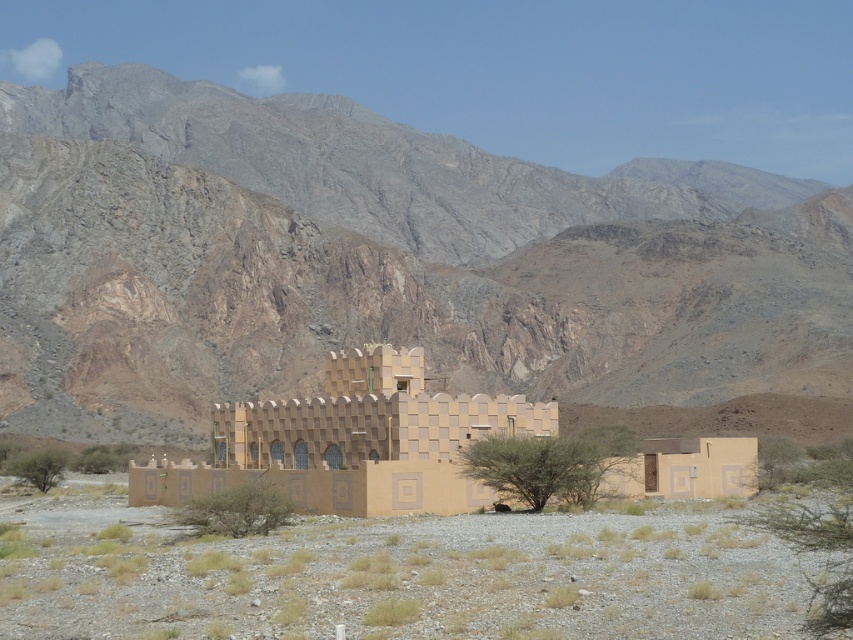
Can you confirm if brown rocky mountain range at upper center is positioned to the left of beige textured fort at center?

Yes, brown rocky mountain range at upper center is to the left of beige textured fort at center.

Who is lower down, brown rocky mountain range at upper center or beige textured fort at center?

Positioned lower is beige textured fort at center.

Which is behind, point (712, 339) or point (321, 488)?

The point (712, 339) is behind.

Where is `brown rocky mountain range at upper center`? brown rocky mountain range at upper center is located at coordinates (380, 260).

Does brown rocky mountain range at upper center appear over beige sand at center?

Indeed, brown rocky mountain range at upper center is positioned over beige sand at center.

Is brown rocky mountain range at upper center positioned in front of beige sand at center?

No, it is behind beige sand at center.

At what (x,y) coordinates should I click in order to perform the action: click on brown rocky mountain range at upper center. Please return your answer as a coordinate pair (x, y). This screenshot has width=853, height=640. Looking at the image, I should click on (380, 260).

Who is positioned more to the right, beige sand at center or beige textured fort at center?

beige sand at center is more to the right.

What do you see at coordinates (393, 573) in the screenshot? I see `beige sand at center` at bounding box center [393, 573].

Is point (364, 564) more distant than point (169, 461)?

No, (364, 564) is closer to viewer.

Locate an element on the screen. The image size is (853, 640). beige sand at center is located at coordinates (393, 573).